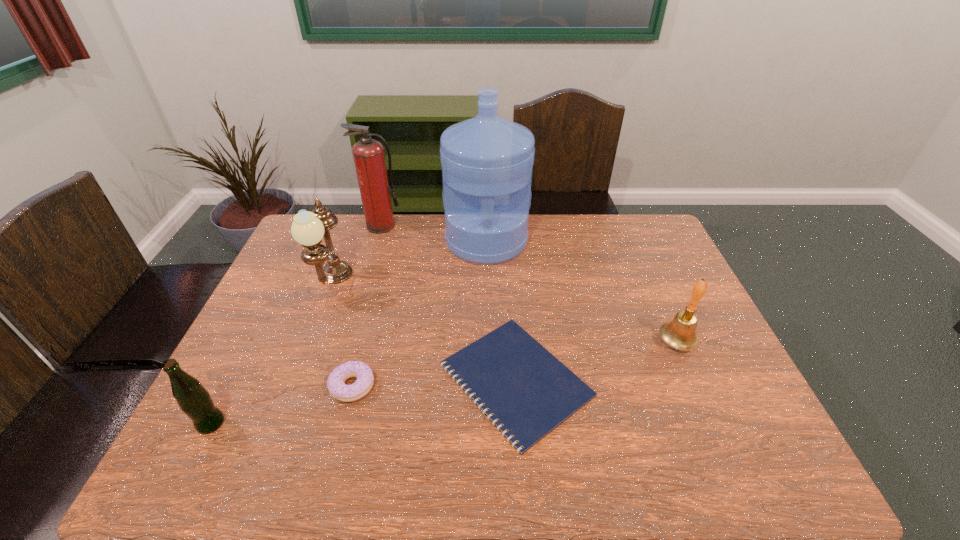
Image resolution: width=960 pixels, height=540 pixels. I want to click on vacant area that satisfies the following two spatial constraints: 1. on the front side of the oil lamp; 2. on the left side of the bell, so click(311, 342).

At what (x,y) coordinates should I click in order to perform the action: click on vacant space that satisfies the following two spatial constraints: 1. on the back side of the doughnut; 2. on the left side of the shortest object. Please return your answer as a coordinate pair (x, y). The height and width of the screenshot is (540, 960). Looking at the image, I should click on pyautogui.click(x=354, y=380).

The image size is (960, 540). What are the coordinates of `vacant space that satisfies the following two spatial constraints: 1. at the nozzle of the fire extinguisher; 2. on the left side of the notepad` in the screenshot? It's located at (336, 380).